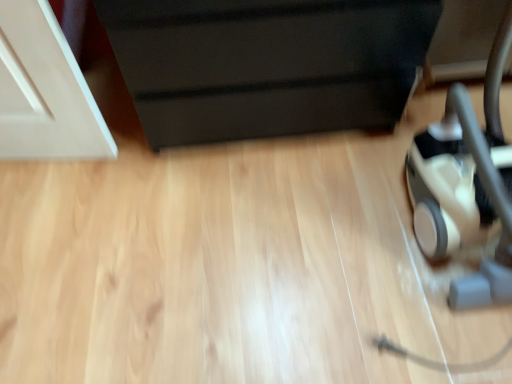
Question: Should I look upward or downward to see beige rubber baby carriage at lower right?

Choices:
 (A) up
 (B) down

Answer: (A)

Question: Is beige rubber baby carriage at lower right behind black matte drawer at upper center?

Choices:
 (A) no
 (B) yes

Answer: (A)

Question: From a real-world perspective, does beige rubber baby carriage at lower right sit lower than black matte drawer at upper center?

Choices:
 (A) yes
 (B) no

Answer: (B)

Question: Does beige rubber baby carriage at lower right appear on the right side of black matte drawer at upper center?

Choices:
 (A) no
 (B) yes

Answer: (B)

Question: Is beige rubber baby carriage at lower right facing away from black matte drawer at upper center?

Choices:
 (A) no
 (B) yes

Answer: (A)

Question: Can you confirm if beige rubber baby carriage at lower right is wider than black matte drawer at upper center?

Choices:
 (A) yes
 (B) no

Answer: (B)

Question: From the image's perspective, is beige rubber baby carriage at lower right above black matte drawer at upper center?

Choices:
 (A) no
 (B) yes

Answer: (A)

Question: Considering the relative sizes of black matte drawer at upper center and beige rubber baby carriage at lower right in the image provided, is black matte drawer at upper center taller than beige rubber baby carriage at lower right?

Choices:
 (A) yes
 (B) no

Answer: (B)

Question: Is black matte drawer at upper center smaller than beige rubber baby carriage at lower right?

Choices:
 (A) no
 (B) yes

Answer: (A)

Question: Does black matte drawer at upper center have a larger size compared to beige rubber baby carriage at lower right?

Choices:
 (A) no
 (B) yes

Answer: (B)

Question: From the image's perspective, does black matte drawer at upper center appear lower than beige rubber baby carriage at lower right?

Choices:
 (A) no
 (B) yes

Answer: (A)

Question: Is black matte drawer at upper center with beige rubber baby carriage at lower right?

Choices:
 (A) no
 (B) yes

Answer: (A)

Question: From a real-world perspective, is black matte drawer at upper center on beige rubber baby carriage at lower right?

Choices:
 (A) yes
 (B) no

Answer: (B)

Question: In terms of width, does black matte drawer at upper center look wider or thinner when compared to beige rubber baby carriage at lower right?

Choices:
 (A) thin
 (B) wide

Answer: (B)